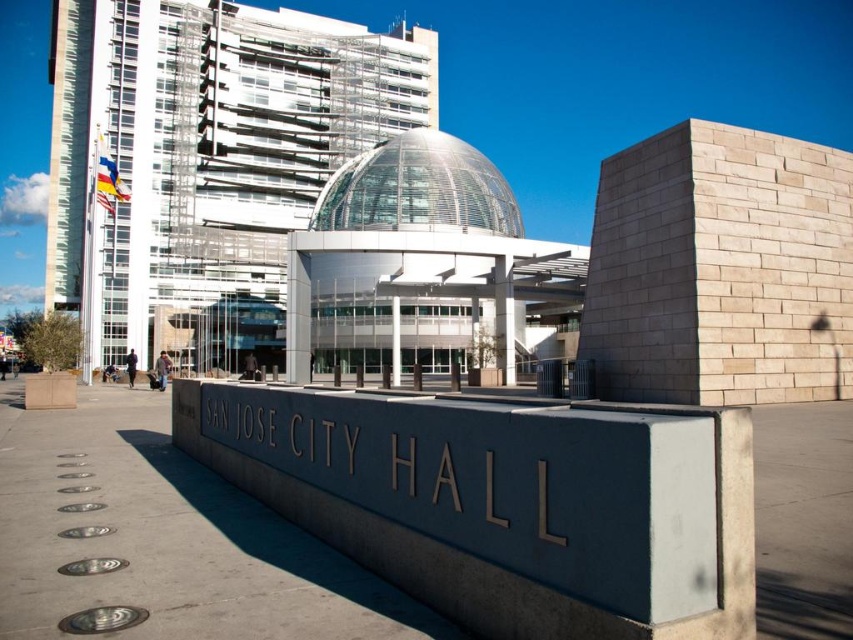
Question: Does gray concrete sign at center appear over transparent glass dome at center?

Choices:
 (A) no
 (B) yes

Answer: (A)

Question: Which of the following is the closest to the observer?

Choices:
 (A) gray concrete sign at center
 (B) transparent glass dome at center

Answer: (A)

Question: Is gray concrete sign at center to the right of transparent glass dome at center from the viewer's perspective?

Choices:
 (A) no
 (B) yes

Answer: (A)

Question: Does gray concrete sign at center have a lesser width compared to transparent glass dome at center?

Choices:
 (A) yes
 (B) no

Answer: (A)